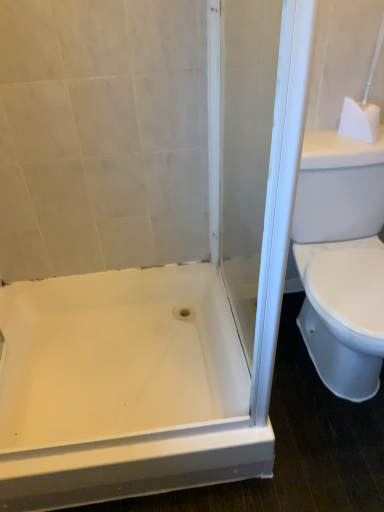
Where is `white smooth bathtub at lower left`? white smooth bathtub at lower left is located at coordinates (117, 357).

What do you see at coordinates (117, 357) in the screenshot? I see `white smooth bathtub at lower left` at bounding box center [117, 357].

Image resolution: width=384 pixels, height=512 pixels. In order to click on white smooth bathtub at lower left in this screenshot , I will do `click(117, 357)`.